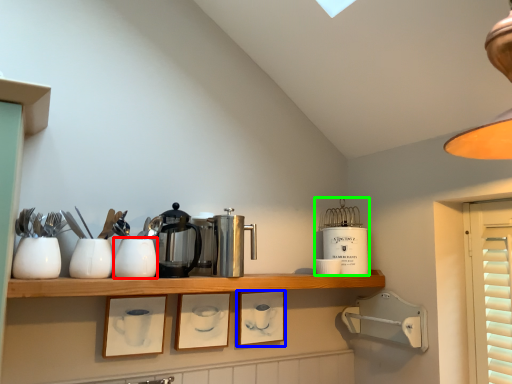
Question: Which is nearer to the tableware (highlighted by a red box)? picture frame (highlighted by a blue box) or appliance (highlighted by a green box).

Choices:
 (A) picture frame
 (B) appliance

Answer: (A)